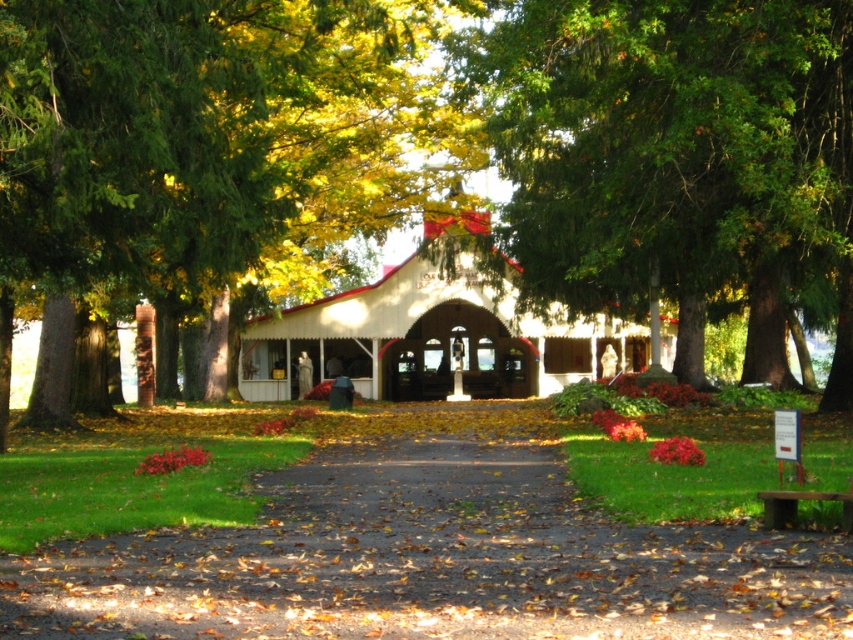
Can you confirm if green leafy tree at center is bigger than white wood chapel at center?

Indeed, green leafy tree at center has a larger size compared to white wood chapel at center.

Who is positioned more to the left, green leafy tree at center or white wood chapel at center?

From the viewer's perspective, green leafy tree at center appears more on the left side.

You are a GUI agent. You are given a task and a screenshot of the screen. Output one action in this format:
    pyautogui.click(x=<x>, y=<y>)
    Task: Click on the green leafy tree at center
    The width and height of the screenshot is (853, 640).
    Given the screenshot: What is the action you would take?
    pyautogui.click(x=209, y=141)

Is brown dirt path at center in front of white wood chapel at center?

That is True.

Can you confirm if brown dirt path at center is bigger than white wood chapel at center?

Actually, brown dirt path at center might be smaller than white wood chapel at center.

Does point (727, 531) come in front of point (326, 364)?

Yes, point (727, 531) is in front of point (326, 364).

The width and height of the screenshot is (853, 640). Identify the location of brown dirt path at center. (433, 563).

Who is positioned more to the left, green leafy tree at center or wooden park bench at lower right?

Positioned to the left is green leafy tree at center.

Who is more distant from viewer, (184, 76) or (822, 492)?

The point (184, 76) is more distant.

Where is `green leafy tree at center`? The height and width of the screenshot is (640, 853). green leafy tree at center is located at coordinates (209, 141).